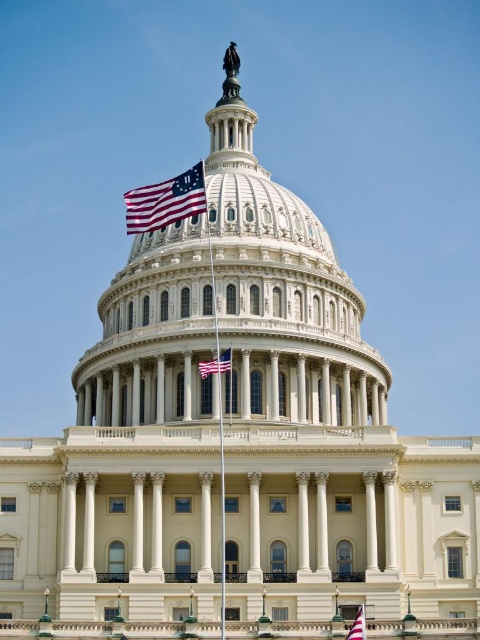
Question: Does white marble dome at center have a smaller size compared to american flag at upper left?

Choices:
 (A) no
 (B) yes

Answer: (A)

Question: Is american flag at upper left smaller than polished metal flag pole at center?

Choices:
 (A) yes
 (B) no

Answer: (B)

Question: Which of the following is the farthest from the observer?

Choices:
 (A) (213, 358)
 (B) (144, 225)
 (C) (219, 477)

Answer: (A)

Question: Based on their relative distances, which object is farther from the white marble dome at center?

Choices:
 (A) american flag at center
 (B) american flag at upper left
 (C) red fabric flag at lower right
 (D) polished metal flag pole at center

Answer: (C)

Question: Considering the relative positions of american flag at upper left and red fabric flag at lower right in the image provided, where is american flag at upper left located with respect to red fabric flag at lower right?

Choices:
 (A) below
 (B) above

Answer: (B)

Question: Among these objects, which one is farthest from the camera?

Choices:
 (A) white marble dome at center
 (B) red fabric flag at lower right
 (C) american flag at upper left

Answer: (C)